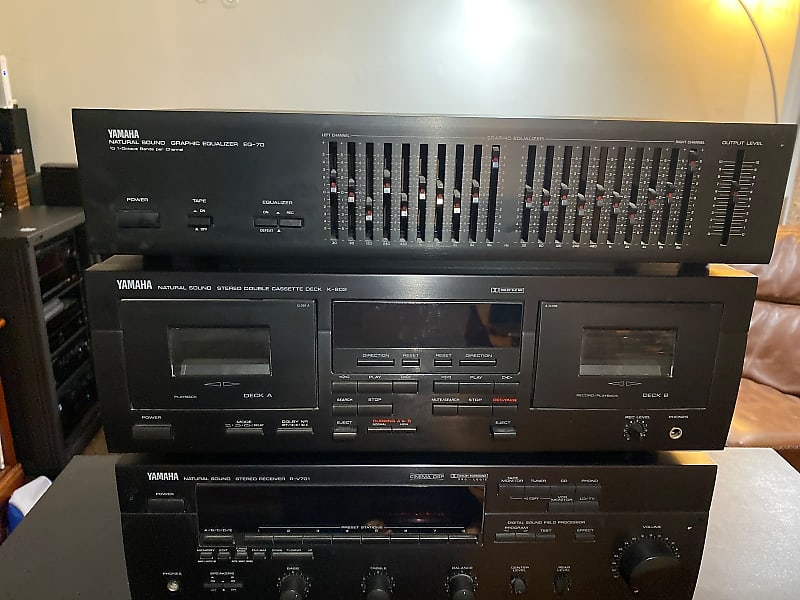
Where is `table`? table is located at coordinates (762, 536), (21, 239).